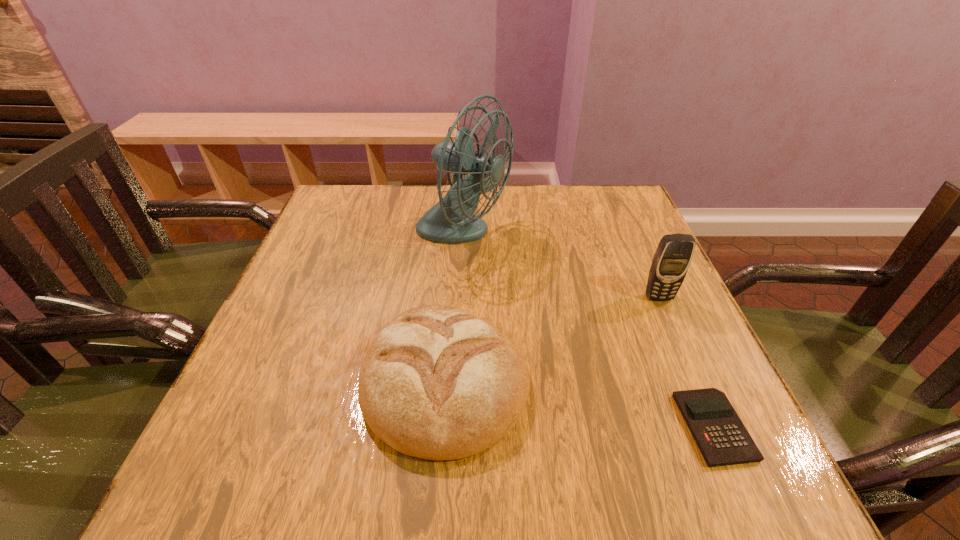
At what (x,y) coordinates should I click in order to perform the action: click on free location at the near left corner of the desktop. Please return your answer as a coordinate pair (x, y). This screenshot has height=540, width=960. Looking at the image, I should click on [x=290, y=450].

At what (x,y) coordinates should I click in order to perform the action: click on vacant area at the near right corner. Please return your answer as a coordinate pair (x, y). The height and width of the screenshot is (540, 960). Looking at the image, I should click on (749, 473).

Where is `empty location between the shortest object and the third tallest object`? The image size is (960, 540). empty location between the shortest object and the third tallest object is located at coordinates (580, 404).

Identify the location of unoccupied position between the third tallest object and the cellular telephone. The height and width of the screenshot is (540, 960). (553, 339).

Locate an element on the screen. free space between the calculator and the second tallest object is located at coordinates 686,362.

The image size is (960, 540). I want to click on free spot between the shortest object and the tallest object, so click(x=588, y=331).

Find the location of a particular element. This screenshot has width=960, height=540. vacant space in between the shortest object and the second farthest object is located at coordinates (686, 362).

Image resolution: width=960 pixels, height=540 pixels. What are the coordinates of `empty space between the calculator and the third nearest object` in the screenshot? It's located at (686, 362).

At what (x,y) coordinates should I click in order to perform the action: click on empty space between the second shortest object and the shortest object. Please return your answer as a coordinate pair (x, y). The height and width of the screenshot is (540, 960). Looking at the image, I should click on (580, 404).

The image size is (960, 540). Find the location of `object that ranks as the second closest to the second shortest object`. object that ranks as the second closest to the second shortest object is located at coordinates (722, 438).